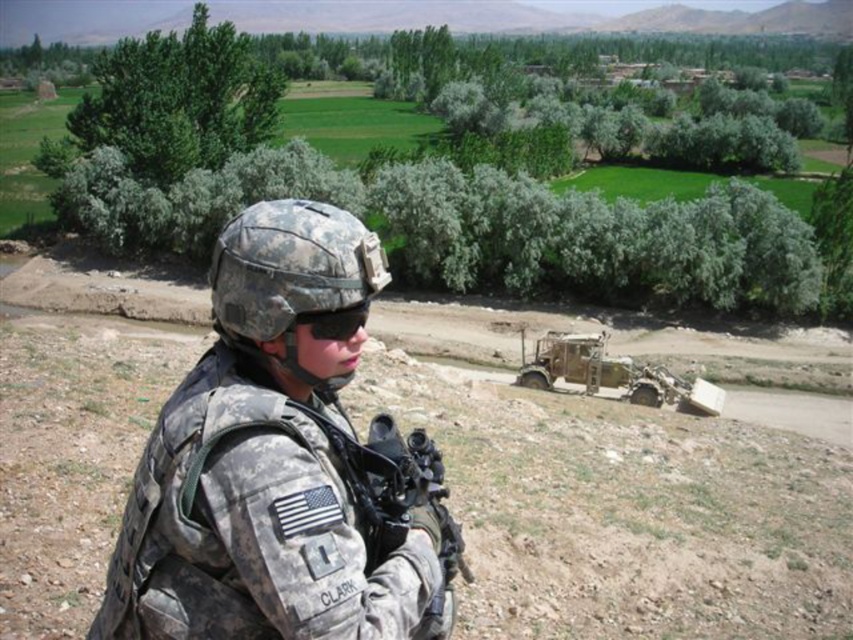
Question: Based on their relative distances, which object is nearer to the camouflage uniform at center?

Choices:
 (A) green leafy bush at upper left
 (B) black matte goggles at center

Answer: (B)

Question: Is camouflage uniform at center bigger than black matte goggles at center?

Choices:
 (A) no
 (B) yes

Answer: (B)

Question: Does camouflage uniform at center have a larger size compared to green leafy bush at upper left?

Choices:
 (A) yes
 (B) no

Answer: (B)

Question: Which point is closer to the camera taking this photo?

Choices:
 (A) (154, 161)
 (B) (322, 573)
 (C) (326, 310)

Answer: (B)

Question: Which point is closer to the camera?

Choices:
 (A) (323, 310)
 (B) (148, 496)

Answer: (B)

Question: Is camouflage uniform at center positioned in front of green leafy bush at upper left?

Choices:
 (A) no
 (B) yes

Answer: (B)